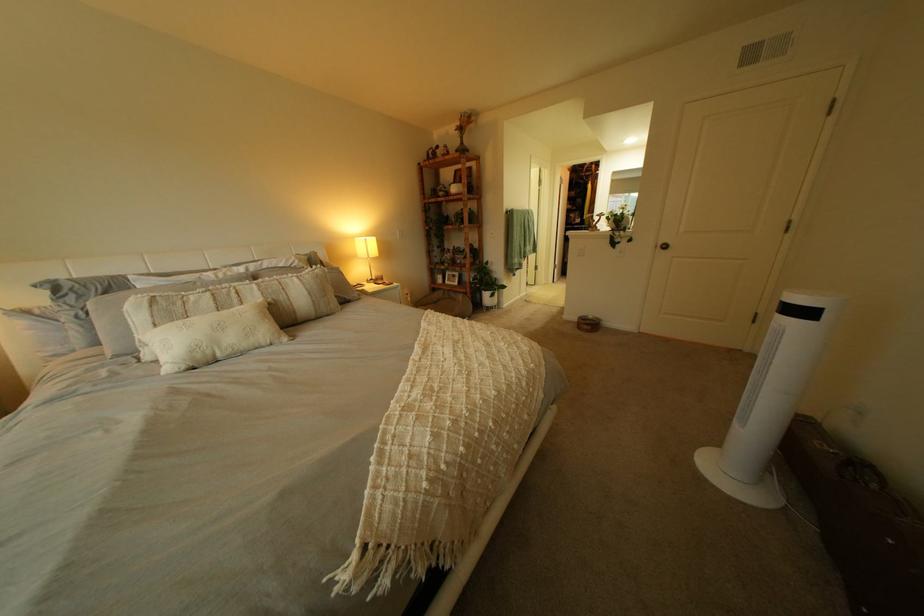
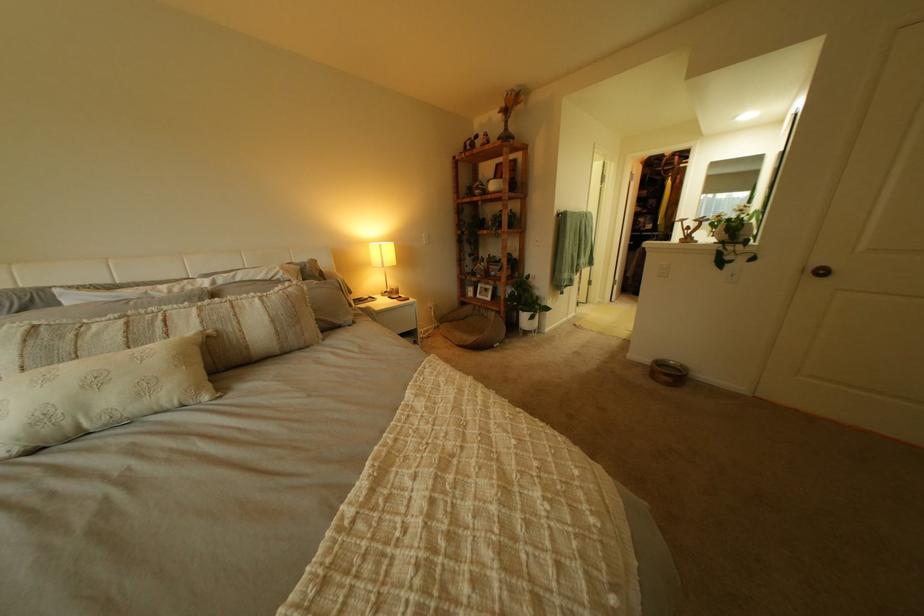
Locate, in the second image, the point that corresponds to (456,286) in the first image.

(485, 300)